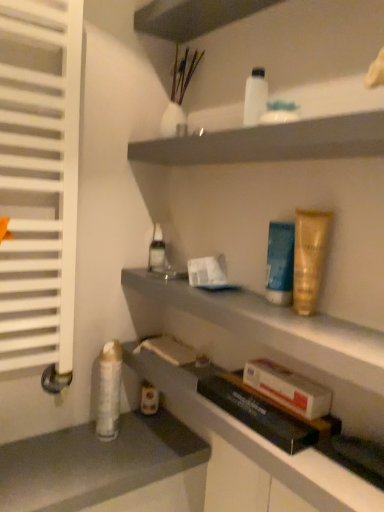
Question: From the image's perspective, is white glossy lotion at upper center, acting as the third toiletry starting from the left, located beneath white glossy shelf at upper center, the second shelf in the bottom-to-top sequence?

Choices:
 (A) no
 (B) yes

Answer: (A)

Question: Would you say white glossy lotion at upper center, acting as the third toiletry starting from the left, is a long distance from white glossy shelf at upper center, the second shelf in the bottom-to-top sequence?

Choices:
 (A) yes
 (B) no

Answer: (B)

Question: Does white glossy lotion at upper center, acting as the third toiletry starting from the left, have a greater height compared to white glossy shelf at upper center, which appears as the 1th shelf when viewed from the top?

Choices:
 (A) no
 (B) yes

Answer: (B)

Question: Does white glossy lotion at upper center, which is the fifth toiletry in bottom-to-top order, appear on the right side of white glossy shelf at upper center, which appears as the 1th shelf when viewed from the top?

Choices:
 (A) yes
 (B) no

Answer: (B)

Question: Considering the relative positions of white glossy lotion at upper center, which is the fifth toiletry in bottom-to-top order, and white glossy shelf at upper center, the second shelf in the bottom-to-top sequence, in the image provided, is white glossy lotion at upper center, which is the fifth toiletry in bottom-to-top order, to the left of white glossy shelf at upper center, the second shelf in the bottom-to-top sequence, from the viewer's perspective?

Choices:
 (A) no
 (B) yes

Answer: (B)

Question: Can you confirm if white glossy lotion at upper center, which is the fifth toiletry in bottom-to-top order, is wider than white glossy shelf at upper center, which appears as the 1th shelf when viewed from the top?

Choices:
 (A) yes
 (B) no

Answer: (B)

Question: Is gold metallic tube at upper right, the 5th toiletry viewed from the left, to the right of gray matte counter at lower left from the viewer's perspective?

Choices:
 (A) no
 (B) yes

Answer: (B)

Question: Is gray matte counter at lower left located within gold metallic tube at upper right, which is counted as the third toiletry, starting from the bottom?

Choices:
 (A) yes
 (B) no

Answer: (B)

Question: Does gold metallic tube at upper right, acting as the 1th toiletry starting from the front, have a greater width compared to gray matte counter at lower left?

Choices:
 (A) yes
 (B) no

Answer: (B)

Question: From the image's perspective, is gold metallic tube at upper right, acting as the 1th toiletry starting from the front, on top of gray matte counter at lower left?

Choices:
 (A) yes
 (B) no

Answer: (A)

Question: Can you confirm if gold metallic tube at upper right, acting as the 1th toiletry starting from the front, is shorter than gray matte counter at lower left?

Choices:
 (A) yes
 (B) no

Answer: (B)

Question: Is gold metallic tube at upper right, the 5th toiletry viewed from the left, not within gray matte counter at lower left?

Choices:
 (A) yes
 (B) no

Answer: (A)

Question: Is white glossy shelf at upper center, the second shelf in the bottom-to-top sequence, wider than white cardboard box at lower center?

Choices:
 (A) no
 (B) yes

Answer: (B)